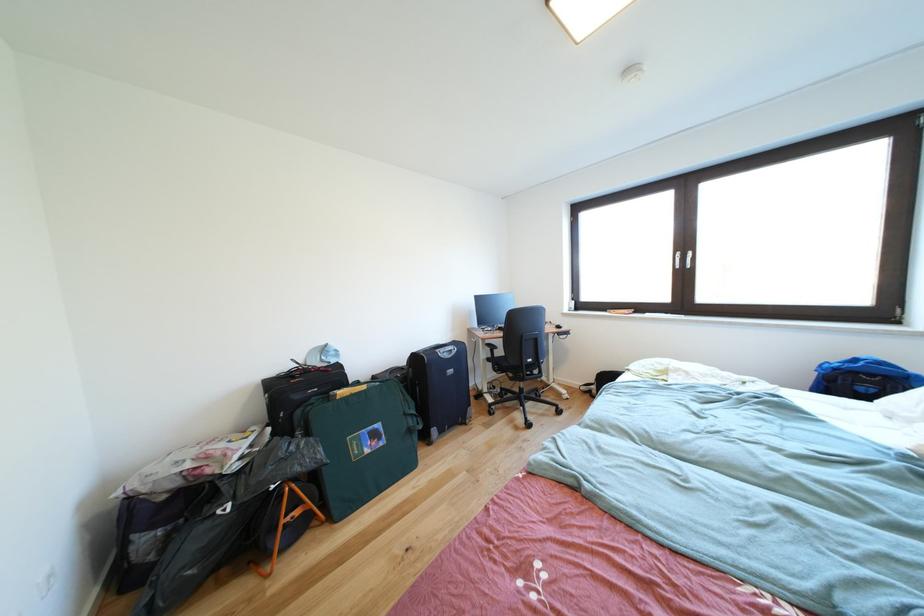
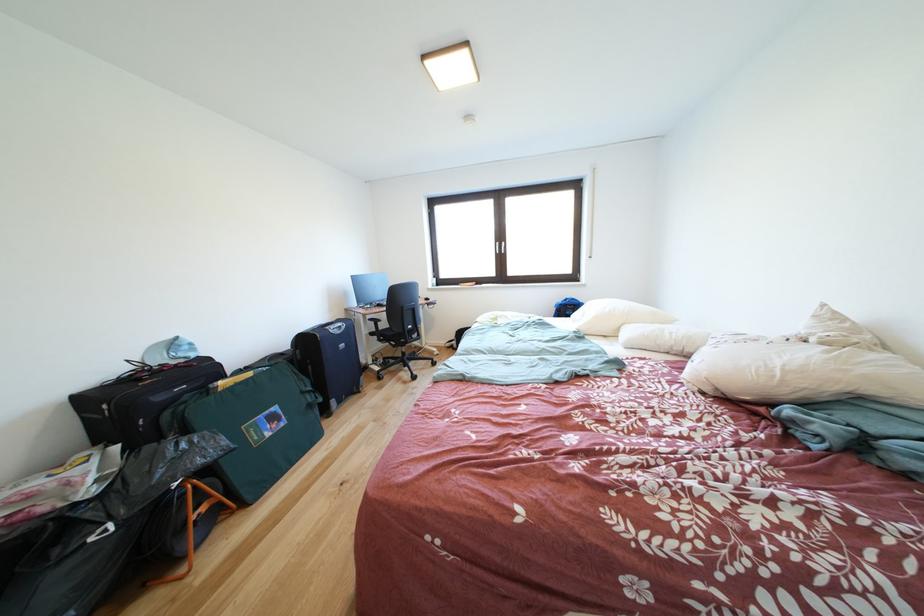
The point at (x=300, y=453) is marked in the first image. Where is the corresponding point in the second image?

(191, 450)